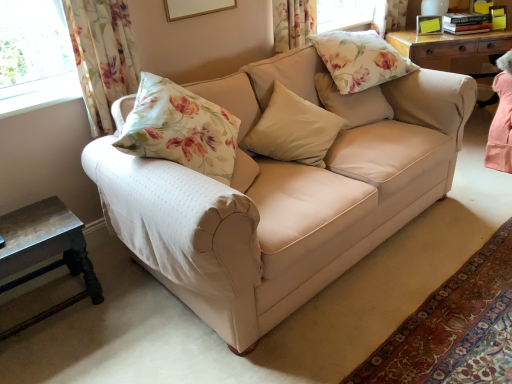
Find the location of a particular element. blank space situated above rustic wood side table at lower left (from a real-world perspective) is located at coordinates (32, 223).